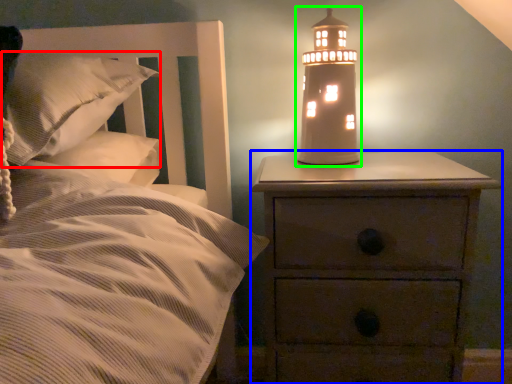
Question: Which is farther away from pillow (highlighted by a red box)? nightstand (highlighted by a blue box) or oil lamp (highlighted by a green box)?

Choices:
 (A) nightstand
 (B) oil lamp

Answer: (A)